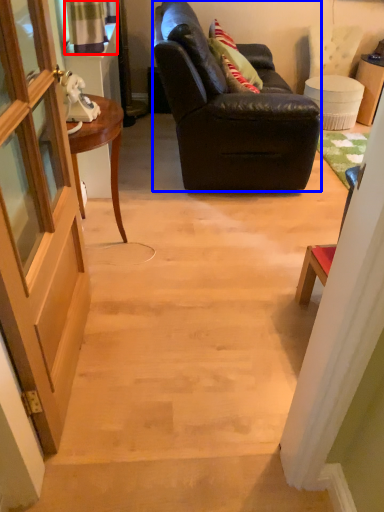
Question: Among these objects, which one is nearest to the camera, curtain (highlighted by a red box) or studio couch (highlighted by a blue box)?

Choices:
 (A) curtain
 (B) studio couch

Answer: (B)